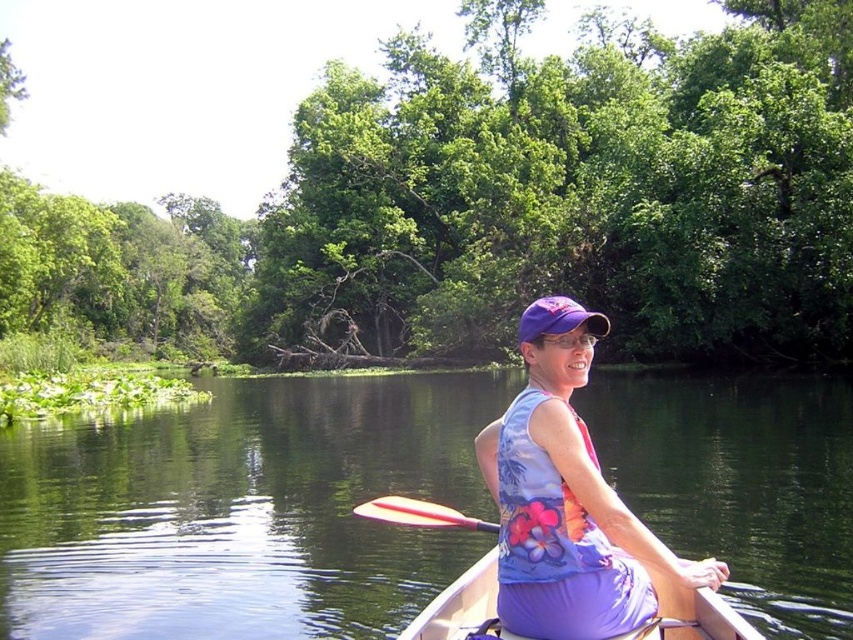
Question: Based on their relative distances, which object is nearer to the pink rubber paddle at center?

Choices:
 (A) purple fabric tank top at center
 (B) white plastic canoe at center

Answer: (B)

Question: Which point is closer to the camera?

Choices:
 (A) white plastic canoe at center
 (B) green smooth water at center

Answer: (A)

Question: Considering the relative positions of green smooth water at center and purple fabric tank top at center in the image provided, where is green smooth water at center located with respect to purple fabric tank top at center?

Choices:
 (A) above
 (B) below

Answer: (B)

Question: Where is green smooth water at center located in relation to purple fabric tank top at center in the image?

Choices:
 (A) below
 (B) above

Answer: (A)

Question: Does purple fabric tank top at center have a smaller size compared to white plastic canoe at center?

Choices:
 (A) yes
 (B) no

Answer: (B)

Question: Estimate the real-world distances between objects in this image. Which object is closer to the white plastic canoe at center?

Choices:
 (A) pink rubber paddle at center
 (B) green smooth water at center

Answer: (A)